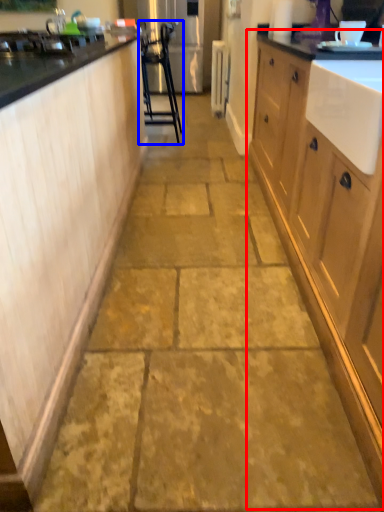
Question: Which object is closer to the camera taking this photo, cabinetry (highlighted by a red box) or furniture (highlighted by a blue box)?

Choices:
 (A) cabinetry
 (B) furniture

Answer: (A)